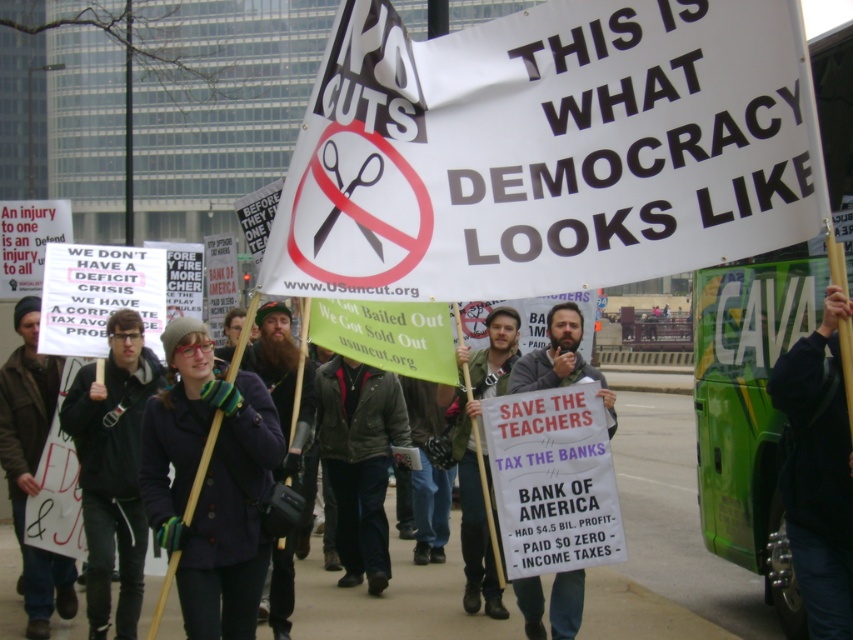
Question: Considering the real-world distances, which object is farthest from the dark gray jacket at center?

Choices:
 (A) black fabric at right
 (B) brown leather jacket at center

Answer: (A)

Question: Is dark gray jacket at center smaller than green fabric jacket at center?

Choices:
 (A) yes
 (B) no

Answer: (A)

Question: Among these points, which one is farthest from the camera?

Choices:
 (A) (126, 444)
 (B) (828, 554)
 (C) (241, 509)

Answer: (A)

Question: Does dark blue woolen coat at center have a smaller size compared to dark gray jacket at center?

Choices:
 (A) no
 (B) yes

Answer: (A)

Question: Which object is positioned farthest from the dark blue woolen coat at center?

Choices:
 (A) brown leather jacket at center
 (B) dark gray hoodie at center

Answer: (A)

Question: Is black fabric at right to the left of green fabric jacket at center from the viewer's perspective?

Choices:
 (A) yes
 (B) no

Answer: (B)